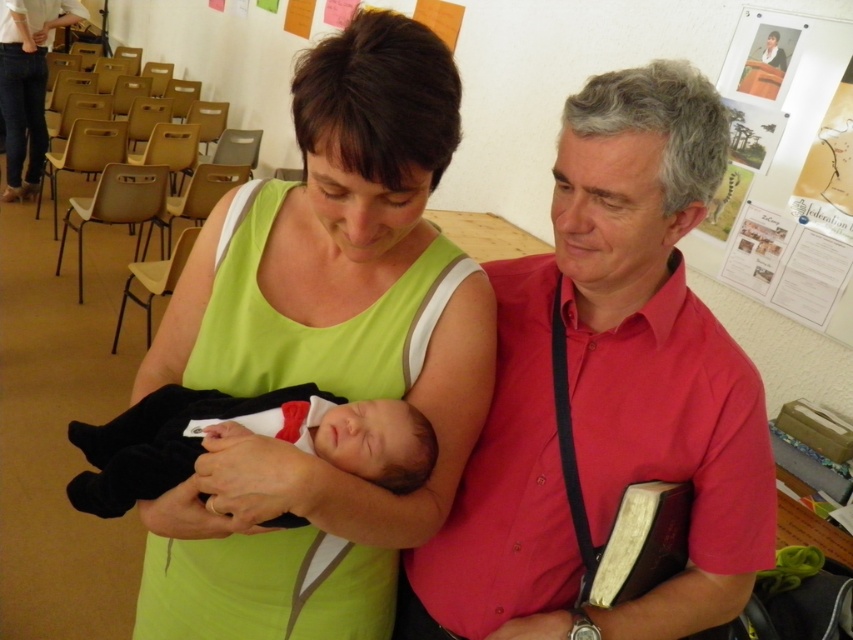
Question: Is paper posters at upper right wider than black cotton newborn at center?

Choices:
 (A) yes
 (B) no

Answer: (B)

Question: Does green fabric dress at center have a smaller size compared to pink cotton shirt at center?

Choices:
 (A) no
 (B) yes

Answer: (A)

Question: Does green fabric dress at center have a greater width compared to pink cotton shirt at center?

Choices:
 (A) yes
 (B) no

Answer: (A)

Question: Which of the following is the farthest from the observer?

Choices:
 (A) (811, 140)
 (B) (444, 604)

Answer: (A)

Question: Which object is farther from the camera taking this photo?

Choices:
 (A) pink cotton shirt at center
 (B) paper posters at upper right

Answer: (B)

Question: Among these objects, which one is farthest from the camera?

Choices:
 (A) green fabric dress at center
 (B) pink cotton shirt at center

Answer: (B)